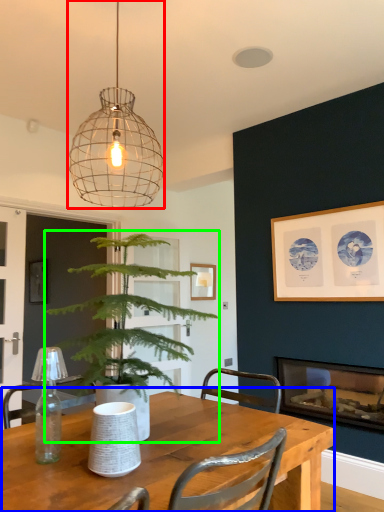
Question: Which is nearer to the lamp (highlighted by a red box)? table (highlighted by a blue box) or houseplant (highlighted by a green box).

Choices:
 (A) table
 (B) houseplant

Answer: (B)